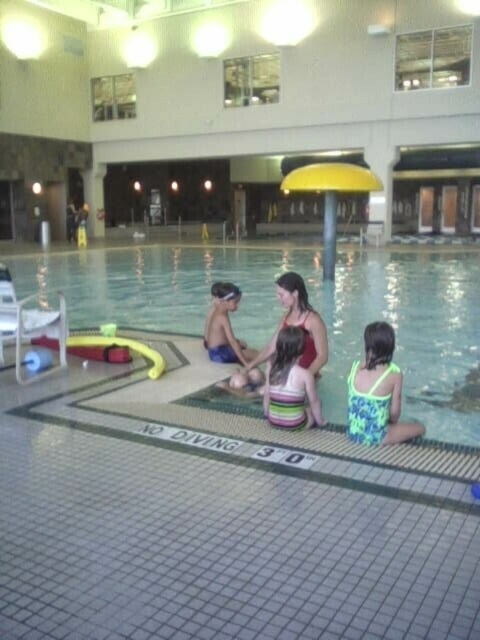
Question: Can you confirm if striped fabric swimsuit at center is wider than blue swim trunks at center?

Choices:
 (A) no
 (B) yes

Answer: (A)

Question: Can you confirm if matte red swimsuit at center is positioned above blue swim trunks at center?

Choices:
 (A) no
 (B) yes

Answer: (A)

Question: Which of the following is the farthest from the observer?

Choices:
 (A) (264, 355)
 (B) (286, 426)
 (C) (12, 276)

Answer: (C)

Question: Considering the real-world distances, which object is farthest from the blue swim trunks at center?

Choices:
 (A) matte red swimsuit at center
 (B) neon green swimsuit at lower right

Answer: (B)

Question: Considering the real-world distances, which object is closest to the neon green swimsuit at lower right?

Choices:
 (A) striped fabric swimsuit at center
 (B) clear plastic pool at center
 (C) blue swim trunks at center

Answer: (A)

Question: Considering the relative positions of clear plastic pool at center and blue swim trunks at center in the image provided, where is clear plastic pool at center located with respect to blue swim trunks at center?

Choices:
 (A) below
 (B) above

Answer: (B)